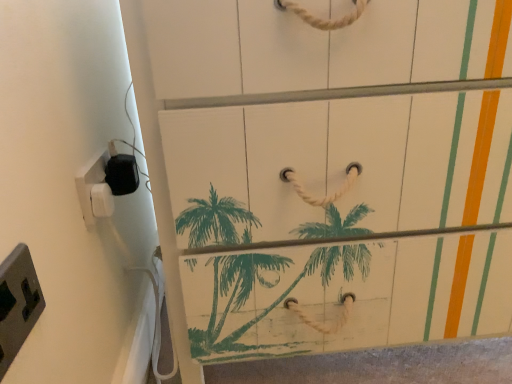
Identify the location of white plastic/light switch at left, which appears as the first light switch when viewed from the back. This screenshot has width=512, height=384. (102, 200).

How much space does white plastic/light switch at left, which ranks as the second light switch in back-to-front order, occupy horizontally?

white plastic/light switch at left, which ranks as the second light switch in back-to-front order, is 0.79 inches in width.

Image resolution: width=512 pixels, height=384 pixels. In order to click on gray plastic/light switch at lower left, acting as the third light switch starting from the back in this screenshot , I will do `click(17, 303)`.

Does point (28, 295) come closer to viewer compared to point (103, 215)?

Yes, point (28, 295) is closer to viewer.

Find the location of a particular element. light switch located in front of the white plastic/light switch at left, which ranks as the second light switch in back-to-front order is located at coordinates (17, 303).

Are gray plastic/light switch at lower left, acting as the third light switch starting from the back, and white plastic/light switch at left, which ranks as the second light switch in back-to-front order, making contact?

No, gray plastic/light switch at lower left, acting as the third light switch starting from the back, is not making contact with white plastic/light switch at left, which ranks as the second light switch in back-to-front order.

Is white plastic/light switch at left, which appears as the first light switch when viewed from the back, to the left or to the right of gray plastic/light switch at lower left, acting as the third light switch starting from the back, in the image?

In the image, white plastic/light switch at left, which appears as the first light switch when viewed from the back, appears on the left side of gray plastic/light switch at lower left, acting as the third light switch starting from the back.

Is white plastic/light switch at left, which appears as the first light switch when viewed from the back, facing away from gray plastic/light switch at lower left, acting as the third light switch starting from the back?

No, gray plastic/light switch at lower left, acting as the third light switch starting from the back, is not at the back of white plastic/light switch at left, which appears as the first light switch when viewed from the back.

From a real-world perspective, is white plastic/light switch at left, which is counted as the third light switch, starting from the front, located higher than gray plastic/light switch at lower left, placed as the 1th light switch when sorted from front to back?

No, from a real-world perspective, white plastic/light switch at left, which is counted as the third light switch, starting from the front, is not on top of gray plastic/light switch at lower left, placed as the 1th light switch when sorted from front to back.

What's the angular difference between gray plastic/light switch at lower left, acting as the third light switch starting from the back, and white plastic/light switch at left, which appears as the first light switch when viewed from the back,'s facing directions?

The angle between the facing direction of gray plastic/light switch at lower left, acting as the third light switch starting from the back, and the facing direction of white plastic/light switch at left, which appears as the first light switch when viewed from the back, is 1.04 degrees.

Which of these two, gray plastic/light switch at lower left, placed as the 1th light switch when sorted from front to back, or white plastic/light switch at left, which is counted as the third light switch, starting from the front, is wider?

Wider between the two is white plastic/light switch at left, which is counted as the third light switch, starting from the front.

The height and width of the screenshot is (384, 512). I want to click on light switch that is the 2nd one when counting forward from the white plastic/light switch at left, which is counted as the third light switch, starting from the front, so click(17, 303).

Looking at their sizes, would you say white plastic/light switch at left, which is counted as the third light switch, starting from the front, is wider or thinner than white plastic/light switch at left, marked as the second light switch in a front-to-back arrangement?

In the image, white plastic/light switch at left, which is counted as the third light switch, starting from the front, appears to be wider than white plastic/light switch at left, marked as the second light switch in a front-to-back arrangement.

Which of these two, white plastic/light switch at left, which appears as the first light switch when viewed from the back, or white plastic/light switch at left, which ranks as the second light switch in back-to-front order, is bigger?

With larger size is white plastic/light switch at left, which ranks as the second light switch in back-to-front order.

In the scene shown: Is there a large distance between white plastic/light switch at left, which appears as the first light switch when viewed from the back, and white plastic/light switch at left, which ranks as the second light switch in back-to-front order?

That's not correct — white plastic/light switch at left, which appears as the first light switch when viewed from the back, is a little close to white plastic/light switch at left, which ranks as the second light switch in back-to-front order.

Between white plastic/light switch at left, marked as the second light switch in a front-to-back arrangement, and gray plastic/light switch at lower left, placed as the 1th light switch when sorted from front to back, which one has larger width?

gray plastic/light switch at lower left, placed as the 1th light switch when sorted from front to back, is wider.

From the image's perspective, which is below, white plastic/light switch at left, marked as the second light switch in a front-to-back arrangement, or gray plastic/light switch at lower left, placed as the 1th light switch when sorted from front to back?

gray plastic/light switch at lower left, placed as the 1th light switch when sorted from front to back.

Does point (82, 168) lie in front of point (24, 329)?

No, (82, 168) is behind (24, 329).

What's the angular difference between white plastic/light switch at left, which ranks as the second light switch in back-to-front order, and white plastic/light switch at left, which is counted as the third light switch, starting from the front,'s facing directions?

The angular difference between white plastic/light switch at left, which ranks as the second light switch in back-to-front order, and white plastic/light switch at left, which is counted as the third light switch, starting from the front, is 1.05 degrees.

Considering the sizes of objects white plastic/light switch at left, marked as the second light switch in a front-to-back arrangement, and white plastic/light switch at left, which is counted as the third light switch, starting from the front, in the image provided, who is smaller, white plastic/light switch at left, marked as the second light switch in a front-to-back arrangement, or white plastic/light switch at left, which is counted as the third light switch, starting from the front,?

Smaller between the two is white plastic/light switch at left, which is counted as the third light switch, starting from the front.

Is point (95, 207) closer to camera compared to point (103, 193)?

Yes, point (95, 207) is in front of point (103, 193).

This screenshot has width=512, height=384. Find the location of `the 2nd light switch to the right of the white plastic/light switch at left, marked as the second light switch in a front-to-back arrangement, starting your count from the anchor`. the 2nd light switch to the right of the white plastic/light switch at left, marked as the second light switch in a front-to-back arrangement, starting your count from the anchor is located at coordinates (17, 303).

The image size is (512, 384). I want to click on light switch that is the 2nd object located behind the gray plastic/light switch at lower left, placed as the 1th light switch when sorted from front to back, so click(102, 200).

Based on their spatial positions, is white plastic/light switch at left, marked as the second light switch in a front-to-back arrangement, or gray plastic/light switch at lower left, acting as the third light switch starting from the back, closer to white plastic/light switch at left, which appears as the first light switch when viewed from the back?

white plastic/light switch at left, marked as the second light switch in a front-to-back arrangement, is positioned closer to the anchor white plastic/light switch at left, which appears as the first light switch when viewed from the back.

Based on their spatial positions, is white plastic/light switch at left, which is counted as the third light switch, starting from the front, or white plastic/light switch at left, marked as the second light switch in a front-to-back arrangement, closer to gray plastic/light switch at lower left, acting as the third light switch starting from the back?

white plastic/light switch at left, marked as the second light switch in a front-to-back arrangement, lies closer to gray plastic/light switch at lower left, acting as the third light switch starting from the back, than the other object.

When comparing their distances from white plastic/light switch at left, which ranks as the second light switch in back-to-front order, does gray plastic/light switch at lower left, placed as the 1th light switch when sorted from front to back, or white plastic/light switch at left, which is counted as the third light switch, starting from the front, seem closer?

white plastic/light switch at left, which is counted as the third light switch, starting from the front, is closer to white plastic/light switch at left, which ranks as the second light switch in back-to-front order.

Which object lies further to the anchor point white plastic/light switch at left, which ranks as the second light switch in back-to-front order, white plastic/light switch at left, which is counted as the third light switch, starting from the front, or gray plastic/light switch at lower left, placed as the 1th light switch when sorted from front to back?

Based on the image, gray plastic/light switch at lower left, placed as the 1th light switch when sorted from front to back, appears to be further to white plastic/light switch at left, which ranks as the second light switch in back-to-front order.

Based on their spatial positions, is gray plastic/light switch at lower left, acting as the third light switch starting from the back, or white plastic/light switch at left, marked as the second light switch in a front-to-back arrangement, further from white plastic/light switch at left, which appears as the first light switch when viewed from the back?

gray plastic/light switch at lower left, acting as the third light switch starting from the back, is positioned further to the anchor white plastic/light switch at left, which appears as the first light switch when viewed from the back.

From the image, which object appears to be nearer to gray plastic/light switch at lower left, acting as the third light switch starting from the back, white plastic/light switch at left, which ranks as the second light switch in back-to-front order, or white plastic/light switch at left, which is counted as the third light switch, starting from the front?

white plastic/light switch at left, which ranks as the second light switch in back-to-front order, is closer to gray plastic/light switch at lower left, acting as the third light switch starting from the back.

At what (x,y) coordinates should I click in order to perform the action: click on light switch positioned between gray plastic/light switch at lower left, acting as the third light switch starting from the back, and white plastic/light switch at left, which appears as the first light switch when viewed from the back, from near to far. Please return your answer as a coordinate pair (x, y). Looking at the image, I should click on (94, 190).